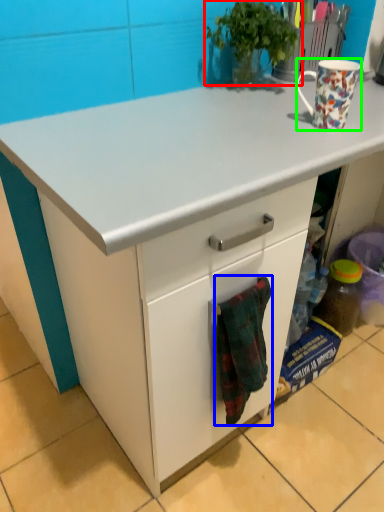
Question: Estimate the real-world distances between objects in this image. Which object is closer to houseplant (highlighted by a red box), blanket (highlighted by a blue box) or coffee cup (highlighted by a green box)?

Choices:
 (A) blanket
 (B) coffee cup

Answer: (B)